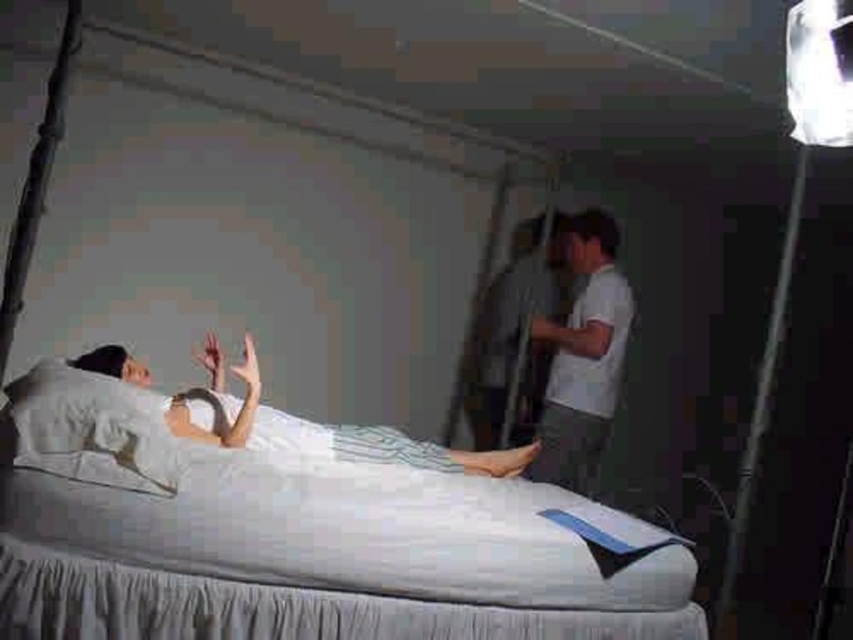
Question: Can you confirm if white cotton shirt at right is positioned above white satin dress at center?

Choices:
 (A) no
 (B) yes

Answer: (B)

Question: Which object is the closest to the white fabric bed at center?

Choices:
 (A) white cotton shirt at right
 (B) white soft pillow at left
 (C) white satin dress at center

Answer: (B)

Question: Considering the real-world distances, which object is closest to the white soft pillow at left?

Choices:
 (A) white satin dress at center
 (B) white cotton shirt at right

Answer: (A)

Question: Is white cotton shirt at right further to the viewer compared to white soft pillow at left?

Choices:
 (A) no
 (B) yes

Answer: (B)

Question: Is white cotton shirt at right closer to camera compared to white soft pillow at left?

Choices:
 (A) no
 (B) yes

Answer: (A)

Question: Which object is farther from the camera taking this photo?

Choices:
 (A) white soft pillow at left
 (B) white satin dress at center

Answer: (B)